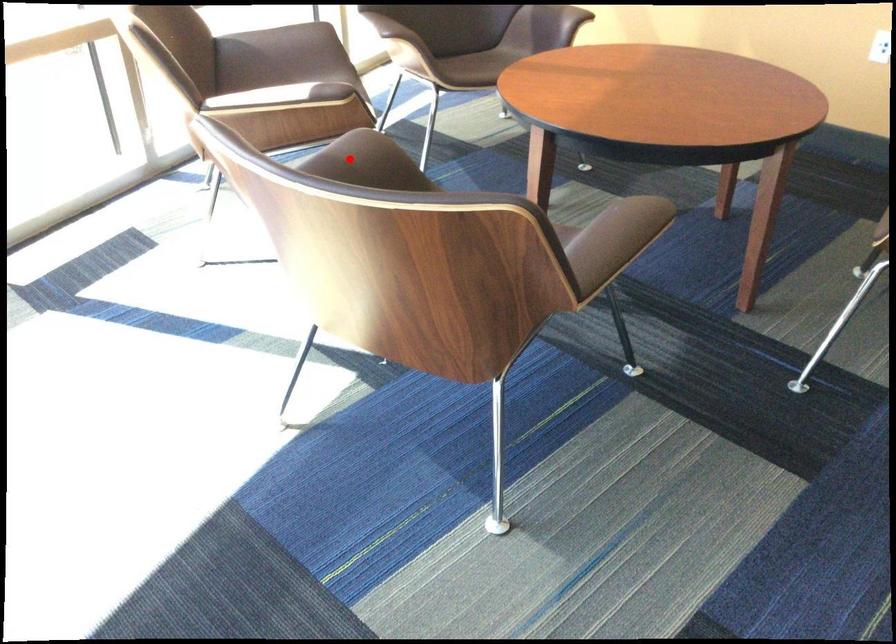
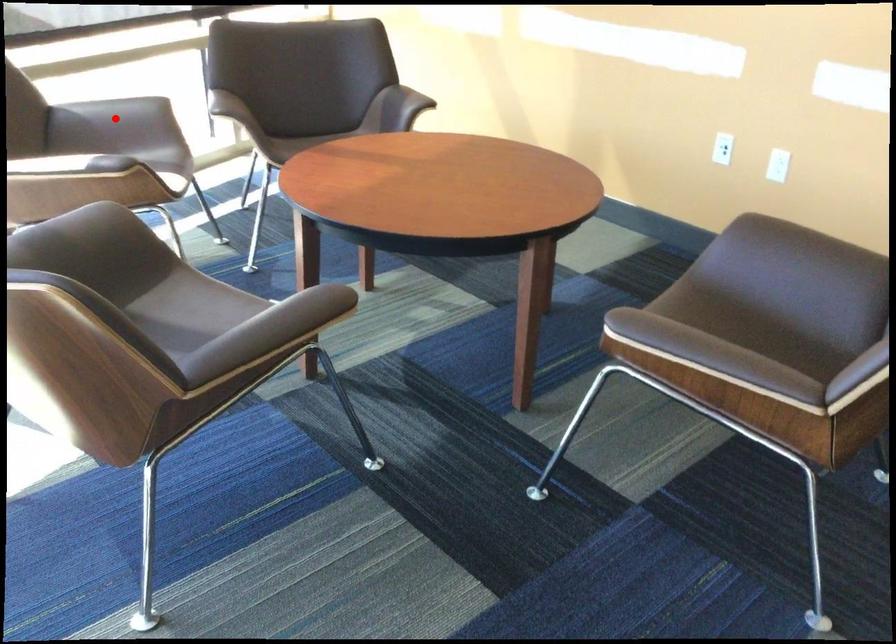
I am providing you with two images of the same scene from different viewpoints. A red point is marked on the first image and another point is marked on the second image. Is the red point in image1 aligned with the point shown in image2?

No